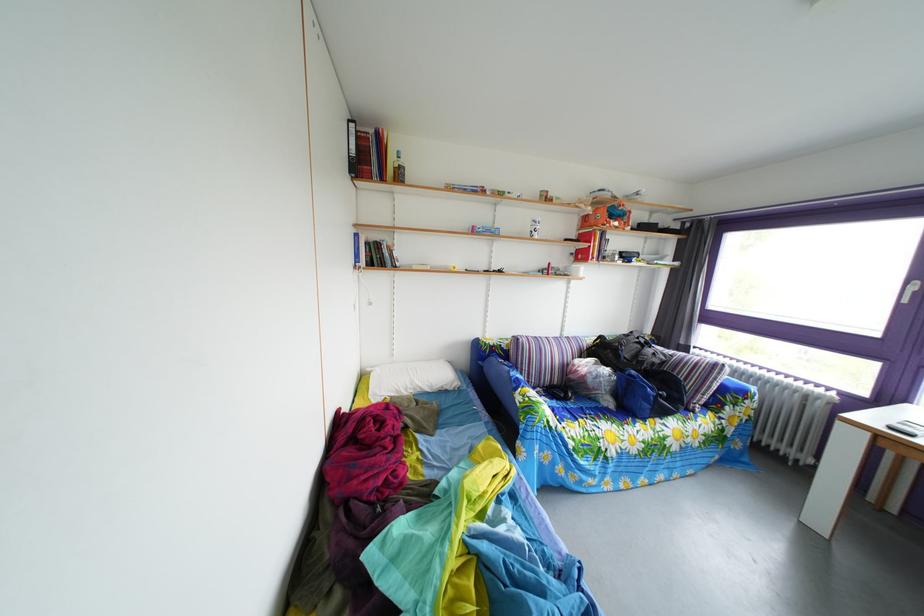
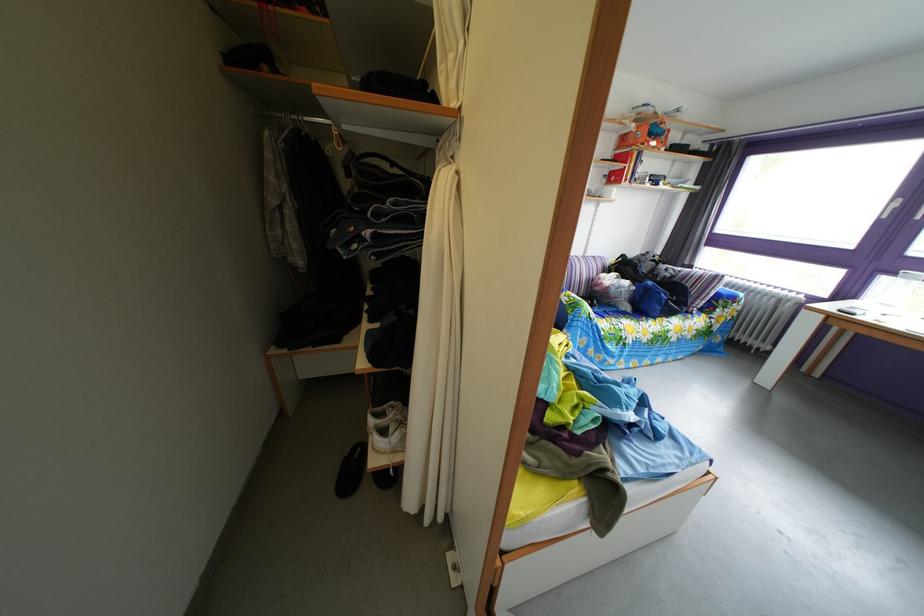
The point at [643,379] is marked in the first image. Where is the corresponding point in the second image?

(661, 291)